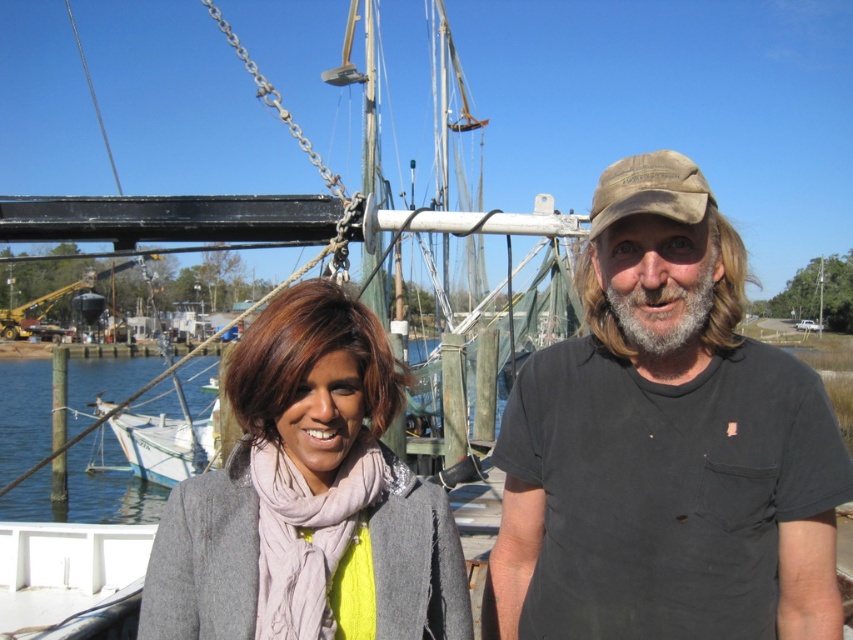
Question: Does black cotton t-shirt at center have a larger size compared to light gray wool coat at center?

Choices:
 (A) yes
 (B) no

Answer: (A)

Question: Which point is farther to the camera?

Choices:
 (A) (712, 305)
 (B) (173, 564)

Answer: (B)

Question: Which of the following is the farthest from the observer?

Choices:
 (A) click(x=695, y=512)
 (B) click(x=254, y=360)

Answer: (A)

Question: Can you confirm if black cotton t-shirt at center is thinner than light gray wool coat at center?

Choices:
 (A) yes
 (B) no

Answer: (B)

Question: Which point is farther to the camera?

Choices:
 (A) light gray wool coat at center
 (B) black cotton t-shirt at center

Answer: (A)

Question: In this image, where is black cotton t-shirt at center located relative to light gray wool coat at center?

Choices:
 (A) left
 (B) right

Answer: (B)